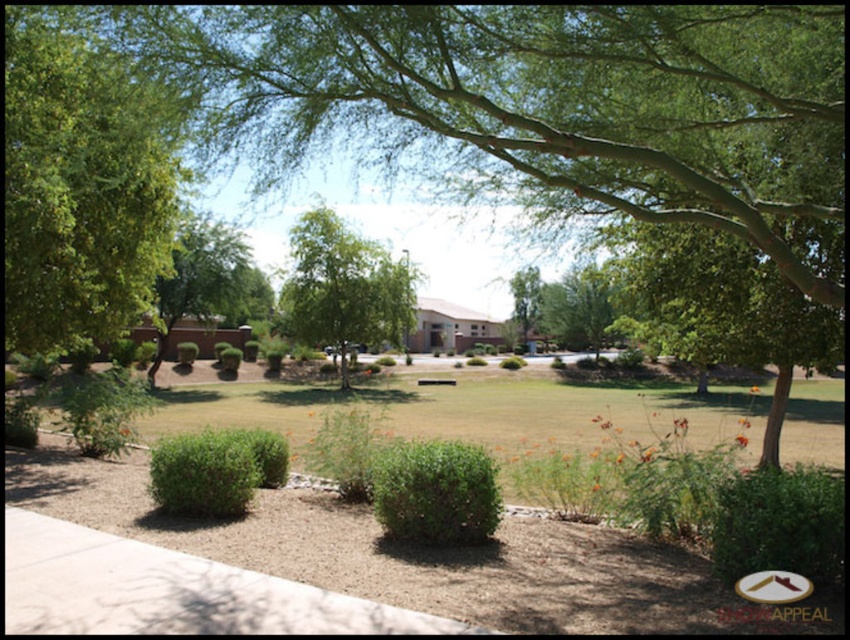
Question: Which object is the farthest from the green leafy tree at left?

Choices:
 (A) green leafy bush at center
 (B) green leafy tree at center
 (C) green leafy tree at upper left
 (D) green textured bush at center

Answer: (B)

Question: Which object appears farthest from the camera in this image?

Choices:
 (A) green leafy tree at left
 (B) green leafy tree at upper left

Answer: (A)

Question: Can you confirm if green leafy tree at upper left is positioned below green leafy hedge at lower right?

Choices:
 (A) yes
 (B) no

Answer: (B)

Question: Can you confirm if green leafy hedge at lower right is positioned to the right of green textured bush at center?

Choices:
 (A) no
 (B) yes

Answer: (B)

Question: Which of the following is the closest to the observer?

Choices:
 (A) (293, 289)
 (B) (819, 504)
 (C) (438, 538)

Answer: (B)

Question: Is green leafy tree at upper left to the left of green leafy bush at center from the viewer's perspective?

Choices:
 (A) no
 (B) yes

Answer: (A)